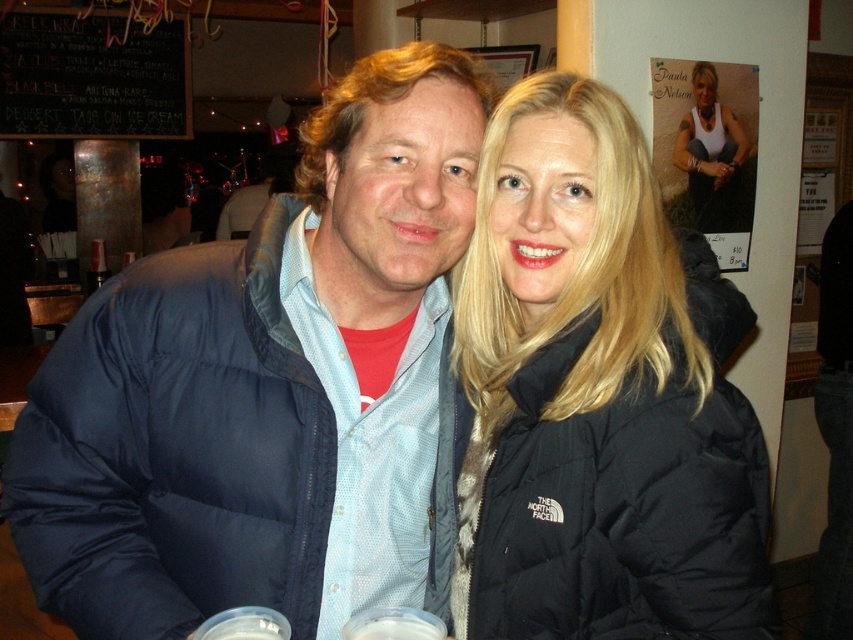
Question: Which is nearer to the black down jacket at center?

Choices:
 (A) white tank top at upper right
 (B) blue down jacket at center

Answer: (B)

Question: Considering the real-world distances, which object is closest to the white tank top at upper right?

Choices:
 (A) blue down jacket at center
 (B) black down jacket at center

Answer: (B)

Question: Does black down jacket at center appear under white tank top at upper right?

Choices:
 (A) no
 (B) yes

Answer: (B)

Question: Which of the following is the farthest from the observer?

Choices:
 (A) white tank top at upper right
 (B) black down jacket at center
 (C) blue down jacket at center

Answer: (A)

Question: Is blue down jacket at center bigger than black down jacket at center?

Choices:
 (A) no
 (B) yes

Answer: (B)

Question: Does blue down jacket at center appear under black down jacket at center?

Choices:
 (A) yes
 (B) no

Answer: (A)